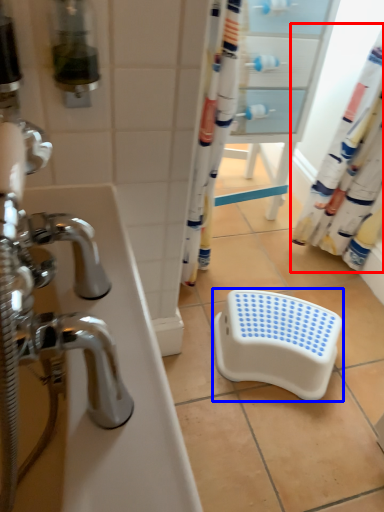
Question: Which object is closer to the camera taking this photo, shower curtain (highlighted by a red box) or step stool (highlighted by a blue box)?

Choices:
 (A) shower curtain
 (B) step stool

Answer: (A)